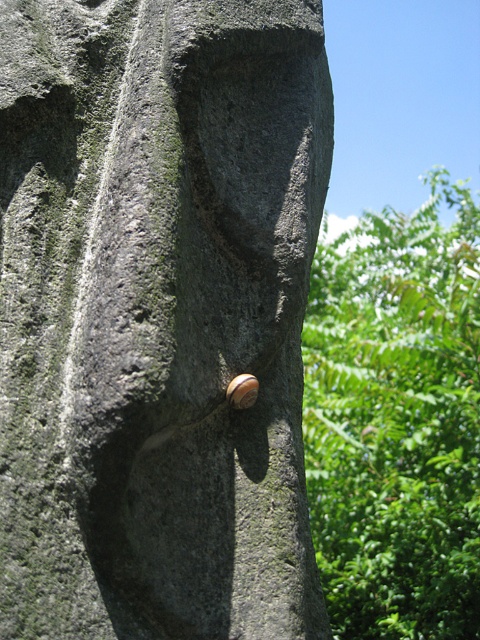
You are standing in front of a stone surface and notice a shiny brown shell at center and a green leafy tree at upper right. Which object is positioned to the right side of the other?

The green leafy tree at upper right is positioned to the right of the shiny brown shell at center.

You are standing in a garden and see the smooth gray stone at center and the green leafy tree at upper right. Which object is located to the right of the other?

The smooth gray stone at center is positioned on the left side of green leafy tree at upper right, so the green leafy tree at upper right is to the right of the smooth gray stone at center.

You are standing 2 meters away from the stone surface. If you want to touch the point at coordinates point (165, 134) on the stone, how much closer do you need to get?

The distance of point (165, 134) from camera is 1.51 meters. Since you are currently 2 meters away, you need to move 0.49 meters closer to reach the point.